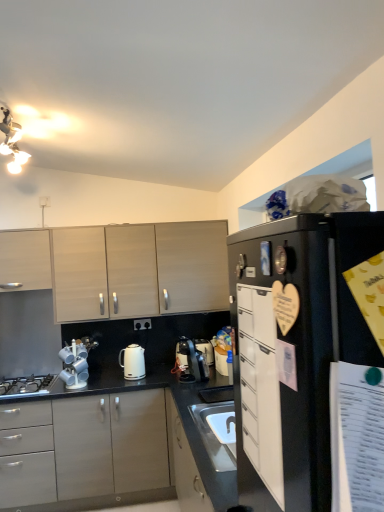
Question: From the image's perspective, is satin black coffee machine at center on light wood/veneer cabinets at upper left, which ranks as the 4th cabinetry in front-to-back order?

Choices:
 (A) yes
 (B) no

Answer: (B)

Question: From a real-world perspective, is satin black coffee machine at center positioned under light wood/veneer cabinets at upper left, which ranks as the 4th cabinetry in front-to-back order, based on gravity?

Choices:
 (A) no
 (B) yes

Answer: (B)

Question: Does satin black coffee machine at center come behind light wood/veneer cabinets at upper left, which ranks as the 4th cabinetry in front-to-back order?

Choices:
 (A) yes
 (B) no

Answer: (B)

Question: Does satin black coffee machine at center have a greater width compared to light wood/veneer cabinets at upper left, the 1th cabinetry in the back-to-front sequence?

Choices:
 (A) no
 (B) yes

Answer: (A)

Question: Is light wood/veneer cabinets at upper left, the 1th cabinetry in the back-to-front sequence, completely or partially inside satin black coffee machine at center?

Choices:
 (A) no
 (B) yes

Answer: (A)

Question: Considering the relative sizes of satin black coffee machine at center and light wood/veneer cabinets at upper left, the 1th cabinetry in the back-to-front sequence, in the image provided, is satin black coffee machine at center taller than light wood/veneer cabinets at upper left, the 1th cabinetry in the back-to-front sequence,?

Choices:
 (A) yes
 (B) no

Answer: (B)

Question: From the image's perspective, would you say black matte refrigerator at upper right is positioned over light wood/veneer cabinets at upper left, the 1th cabinetry in the back-to-front sequence?

Choices:
 (A) yes
 (B) no

Answer: (B)

Question: From a real-world perspective, is black matte refrigerator at upper right over light wood/veneer cabinets at upper left, the 1th cabinetry in the back-to-front sequence?

Choices:
 (A) yes
 (B) no

Answer: (B)

Question: From the image's perspective, would you say black matte refrigerator at upper right is shown under light wood/veneer cabinets at upper left, which ranks as the 4th cabinetry in front-to-back order?

Choices:
 (A) no
 (B) yes

Answer: (B)

Question: Does black matte refrigerator at upper right have a smaller size compared to light wood/veneer cabinets at upper left, the 1th cabinetry in the back-to-front sequence?

Choices:
 (A) yes
 (B) no

Answer: (A)

Question: Does black matte refrigerator at upper right come in front of light wood/veneer cabinets at upper left, the 1th cabinetry in the back-to-front sequence?

Choices:
 (A) no
 (B) yes

Answer: (B)

Question: Is black matte refrigerator at upper right completely or partially outside of light wood/veneer cabinets at upper left, the 1th cabinetry in the back-to-front sequence?

Choices:
 (A) yes
 (B) no

Answer: (A)

Question: Is black matte refrigerator at upper right turned away from metallic silver cup rack at lower left?

Choices:
 (A) yes
 (B) no

Answer: (B)